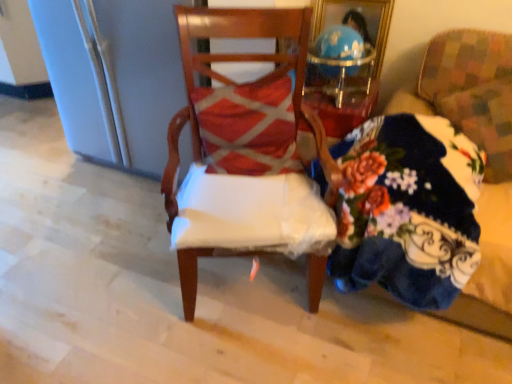
Locate an element on the screen. The width and height of the screenshot is (512, 384). floral fabric couch at right is located at coordinates (441, 233).

Describe the element at coordinates (469, 92) in the screenshot. I see `floral-patterned fabric at right, which is the second chair from left to right` at that location.

This screenshot has width=512, height=384. Identify the location of textured red pillow at center. (249, 127).

At what (x,y) coordinates should I click in order to perform the action: click on floral fabric couch at right. Please return your answer as a coordinate pair (x, y). The image size is (512, 384). Looking at the image, I should click on (441, 233).

Considering the relative positions of floral fabric couch at right and floral-patterned fabric at right, which is the second chair from left to right, in the image provided, is floral fabric couch at right to the left or to the right of floral-patterned fabric at right, which is the second chair from left to right,?

Clearly, floral fabric couch at right is on the left of floral-patterned fabric at right, which is the second chair from left to right, in the image.

Is floral fabric couch at right turned away from floral-patterned fabric at right, which is the second chair from left to right?

Absolutely, floral fabric couch at right is directed away from floral-patterned fabric at right, which is the second chair from left to right.

Considering the relative sizes of floral fabric couch at right and floral-patterned fabric at right, which is the second chair from left to right, in the image provided, is floral fabric couch at right bigger than floral-patterned fabric at right, which is the second chair from left to right,?

Yes, floral fabric couch at right is bigger than floral-patterned fabric at right, which is the second chair from left to right.

Is floral fabric couch at right located outside floral-patterned fabric at right, the first chair when ordered from right to left?

That's correct, floral fabric couch at right is outside of floral-patterned fabric at right, the first chair when ordered from right to left.

Could you tell me if wooden chair at center, the second chair from the right, is facing floral fabric couch at right?

No, wooden chair at center, the second chair from the right, is not turned towards floral fabric couch at right.

Does wooden chair at center, the second chair from the right, have a greater width compared to floral fabric couch at right?

In fact, wooden chair at center, the second chair from the right, might be narrower than floral fabric couch at right.

Are wooden chair at center, the first chair from the left, and floral fabric couch at right beside each other?

wooden chair at center, the first chair from the left, and floral fabric couch at right are clearly separated.

Looking at the image, does wooden chair at center, the first chair from the left, seem bigger or smaller compared to floral fabric couch at right?

In the image, wooden chair at center, the first chair from the left, appears to be smaller than floral fabric couch at right.

From a real-world perspective, is floral-patterned fabric at right, the first chair when ordered from right to left, over floral fabric couch at right?

Indeed, from a real-world perspective, floral-patterned fabric at right, the first chair when ordered from right to left, stands above floral fabric couch at right.

Is floral-patterned fabric at right, the first chair when ordered from right to left, surrounding floral fabric couch at right?

That's incorrect, floral fabric couch at right is not inside floral-patterned fabric at right, the first chair when ordered from right to left.

Is floral-patterned fabric at right, which is the second chair from left to right, bigger or smaller than floral fabric couch at right?

Considering their sizes, floral-patterned fabric at right, which is the second chair from left to right, takes up less space than floral fabric couch at right.

Are floral-patterned fabric at right, which is the second chair from left to right, and floral fabric couch at right far apart?

No, floral-patterned fabric at right, which is the second chair from left to right, is in close proximity to floral fabric couch at right.

Consider the image. Can you confirm if textured red pillow at center is wider than wooden chair at center, the first chair from the left?

Incorrect, the width of textured red pillow at center does not surpass that of wooden chair at center, the first chair from the left.

Consider the image. From the image's perspective, is textured red pillow at center under wooden chair at center, the first chair from the left?

Actually, textured red pillow at center appears above wooden chair at center, the first chair from the left, in the image.

Is textured red pillow at center further to camera compared to wooden chair at center, the first chair from the left?

Yes, it is.

Is the surface of textured red pillow at center in direct contact with wooden chair at center, the first chair from the left?

textured red pillow at center is not next to wooden chair at center, the first chair from the left, and they're not touching.

From a real-world perspective, which object stands above the other?

textured red pillow at center, from a real-world perspective.

Between floral-patterned fabric at right, the first chair when ordered from right to left, and textured red pillow at center, which one has smaller width?

textured red pillow at center is thinner.

Considering the sizes of floral-patterned fabric at right, the first chair when ordered from right to left, and textured red pillow at center in the image, is floral-patterned fabric at right, the first chair when ordered from right to left, taller or shorter than textured red pillow at center?

Considering their sizes, floral-patterned fabric at right, the first chair when ordered from right to left, has more height than textured red pillow at center.

Can you confirm if floral-patterned fabric at right, the first chair when ordered from right to left, is bigger than textured red pillow at center?

Yes.

Is point (276, 32) more distant than point (471, 101)?

No.

Could floral-patterned fabric at right, which is the second chair from left to right, be considered to be inside wooden chair at center, the second chair from the right?

No.

Between point (255, 136) and point (473, 128), which one is positioned behind?

The point (473, 128) is farther from the camera.

From a real-world perspective, which is physically below, textured red pillow at center or floral fabric couch at right?

floral fabric couch at right is physically lower.

Is textured red pillow at center oriented towards floral fabric couch at right?

No, textured red pillow at center is not aimed at floral fabric couch at right.

I want to click on chair on the right of floral fabric couch at right, so click(x=469, y=92).

Identify the location of the 1st chair located above the floral fabric couch at right (from a real-world perspective). (244, 174).

Based on their spatial positions, is wooden chair at center, the second chair from the right, or floral fabric couch at right further from textured red pillow at center?

floral fabric couch at right is positioned further to the anchor textured red pillow at center.

Looking at the image, which one is located further to textured red pillow at center, wooden chair at center, the first chair from the left, or floral-patterned fabric at right, which is the second chair from left to right?

Based on the image, floral-patterned fabric at right, which is the second chair from left to right, appears to be further to textured red pillow at center.

From the image, which object appears to be nearer to textured red pillow at center, floral-patterned fabric at right, which is the second chair from left to right, or wooden chair at center, the first chair from the left?

The object closer to textured red pillow at center is wooden chair at center, the first chair from the left.

Looking at this image, from the image, which object appears to be farther from floral fabric couch at right, floral-patterned fabric at right, the first chair when ordered from right to left, or wooden chair at center, the first chair from the left?

The object further to floral fabric couch at right is wooden chair at center, the first chair from the left.

Considering their positions, is floral fabric couch at right positioned further to floral-patterned fabric at right, the first chair when ordered from right to left, than wooden chair at center, the second chair from the right?

wooden chair at center, the second chair from the right.

Estimate the real-world distances between objects in this image. Which object is closer to wooden chair at center, the first chair from the left, floral-patterned fabric at right, the first chair when ordered from right to left, or floral fabric couch at right?

The object closer to wooden chair at center, the first chair from the left, is floral fabric couch at right.

Estimate the real-world distances between objects in this image. Which object is closer to textured red pillow at center, floral fabric couch at right or wooden chair at center, the first chair from the left?

wooden chair at center, the first chair from the left, lies closer to textured red pillow at center than the other object.

Looking at this image, which object lies nearer to the anchor point floral-patterned fabric at right, which is the second chair from left to right, wooden chair at center, the second chair from the right, or floral fabric couch at right?

Among the two, floral fabric couch at right is located nearer to floral-patterned fabric at right, which is the second chair from left to right.

The width and height of the screenshot is (512, 384). In order to click on couch located between textured red pillow at center and floral-patterned fabric at right, which is the second chair from left to right, in the left-right direction in this screenshot , I will do `click(441, 233)`.

Image resolution: width=512 pixels, height=384 pixels. In order to click on pillow between wooden chair at center, the second chair from the right, and floral fabric couch at right, in the horizontal direction in this screenshot , I will do `click(249, 127)`.

You are a GUI agent. You are given a task and a screenshot of the screen. Output one action in this format:
    pyautogui.click(x=<x>, y=<y>)
    Task: Click on the couch situated between wooden chair at center, the second chair from the right, and floral-patterned fabric at right, the first chair when ordered from right to left, from left to right
    Image resolution: width=512 pixels, height=384 pixels.
    Given the screenshot: What is the action you would take?
    pyautogui.click(x=441, y=233)

The width and height of the screenshot is (512, 384). In order to click on pillow between wooden chair at center, the second chair from the right, and floral-patterned fabric at right, the first chair when ordered from right to left in this screenshot , I will do `click(249, 127)`.